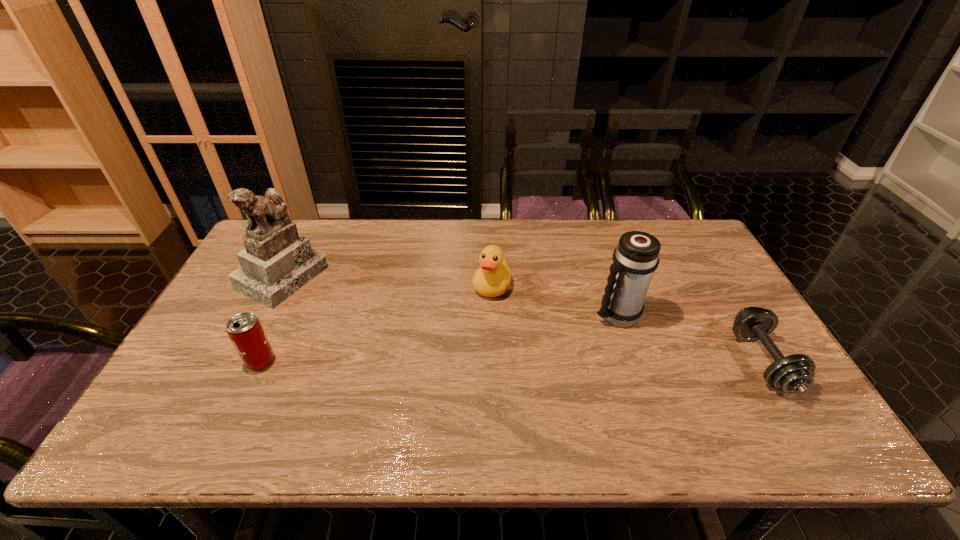
Where is `beer can`? beer can is located at coordinates (245, 331).

Image resolution: width=960 pixels, height=540 pixels. I want to click on the rightmost object, so click(x=795, y=373).

At what (x,y) coordinates should I click in order to perform the action: click on dumbbell. Please return your answer as a coordinate pair (x, y). Looking at the image, I should click on click(795, 373).

You are a GUI agent. You are given a task and a screenshot of the screen. Output one action in this format:
    pyautogui.click(x=<x>, y=<y>)
    Task: Click on the second object from right to left
    
    Given the screenshot: What is the action you would take?
    pyautogui.click(x=636, y=257)

Locate an element on the screen. The height and width of the screenshot is (540, 960). the second tallest object is located at coordinates (636, 257).

Where is `the tallest object`? the tallest object is located at coordinates (277, 262).

Where is `duck`? The width and height of the screenshot is (960, 540). duck is located at coordinates (492, 279).

In order to click on free space located on the back of the beer can in this screenshot , I will do `click(308, 259)`.

Find the location of a particular element. This screenshot has width=960, height=540. vacant space located on the back of the shortest object is located at coordinates (706, 266).

Image resolution: width=960 pixels, height=540 pixels. Find the location of `vacant space located on the side with the handle of the thermos bottle`. vacant space located on the side with the handle of the thermos bottle is located at coordinates (546, 369).